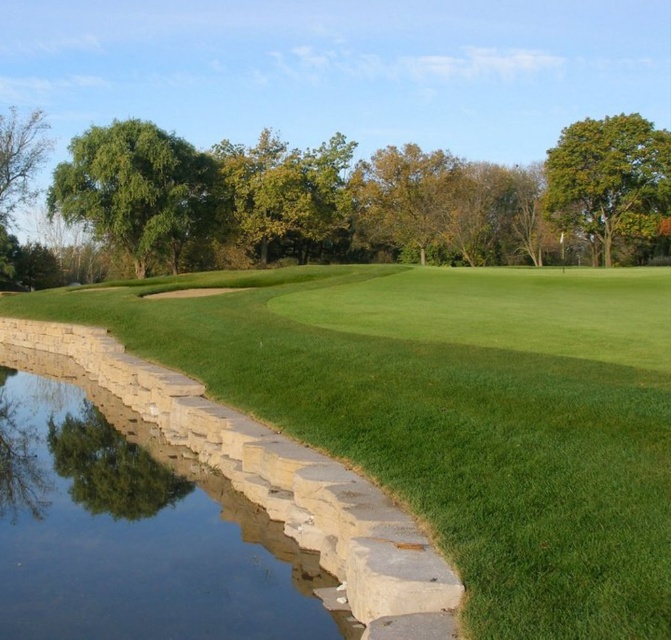
Question: Which object is closer to the camera taking this photo?

Choices:
 (A) green leafy tree at upper right
 (B) green leafy tree at upper left
 (C) green leafy tree at left

Answer: (B)

Question: In this image, where is green leafy tree at left located relative to green leafy tree at upper right?

Choices:
 (A) below
 (B) above

Answer: (B)

Question: Is the position of green leafy tree at upper left less distant than that of green leafy tree at upper right?

Choices:
 (A) yes
 (B) no

Answer: (A)

Question: Considering the real-world distances, which object is closest to the clear water at bottom left?

Choices:
 (A) green leafy tree at left
 (B) green leafy tree at upper right
 (C) green leafy tree at upper left
 (D) green grass at center

Answer: (D)

Question: Can you confirm if clear water at bottom left is thinner than green leafy tree at upper right?

Choices:
 (A) yes
 (B) no

Answer: (A)

Question: Which point appears farthest from the camera in this image?

Choices:
 (A) (211, 166)
 (B) (668, 192)
 (C) (266, 276)

Answer: (A)